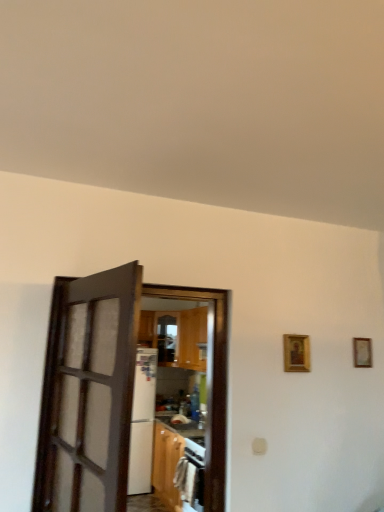
Describe the element at coordinates (296, 353) in the screenshot. I see `gold-framed picture at upper right, which is the second picture frame in right-to-left order` at that location.

The image size is (384, 512). What are the coordinates of `gold-framed picture at right, the 2th picture frame from the left` in the screenshot? It's located at [362, 352].

Describe the element at coordinates (362, 352) in the screenshot. I see `gold-framed picture at right, the 2th picture frame from the left` at that location.

At what (x,y) coordinates should I click in order to perform the action: click on brown wooden door at center, the second door in the front-to-back sequence. Please return your answer as a coordinate pair (x, y). The height and width of the screenshot is (512, 384). Looking at the image, I should click on 211,383.

From the image's perspective, which is above, dark wood door at left, the 1th door from the front, or gold-framed picture at upper right, the first picture frame in the left-to-right sequence?

gold-framed picture at upper right, the first picture frame in the left-to-right sequence, from the image's perspective.

Does dark wood door at left, the 1th door from the front, have a lesser width compared to gold-framed picture at upper right, the first picture frame in the left-to-right sequence?

In fact, dark wood door at left, the 1th door from the front, might be wider than gold-framed picture at upper right, the first picture frame in the left-to-right sequence.

Considering the sizes of objects dark wood door at left, arranged as the 2th door when viewed from the back, and gold-framed picture at upper right, which is the second picture frame in right-to-left order, in the image provided, who is taller, dark wood door at left, arranged as the 2th door when viewed from the back, or gold-framed picture at upper right, which is the second picture frame in right-to-left order,?

Standing taller between the two is dark wood door at left, arranged as the 2th door when viewed from the back.

Could you tell me if dark wood door at left, arranged as the 2th door when viewed from the back, is facing gold-framed picture at upper right, the first picture frame in the left-to-right sequence?

Yes, dark wood door at left, arranged as the 2th door when viewed from the back, is facing gold-framed picture at upper right, the first picture frame in the left-to-right sequence.

Which of these two, dark wood door at left, the 1th door from the front, or brown wooden door at center, the second door in the front-to-back sequence, is wider?

Wider between the two is brown wooden door at center, the second door in the front-to-back sequence.

Would you say dark wood door at left, the 1th door from the front, is a long distance from brown wooden door at center, which is counted as the first door, starting from the back?

No, there isn't a large distance between dark wood door at left, the 1th door from the front, and brown wooden door at center, which is counted as the first door, starting from the back.

Find the location of `door lying above the brown wooden door at center, which is counted as the first door, starting from the back (from the image's perspective)`. door lying above the brown wooden door at center, which is counted as the first door, starting from the back (from the image's perspective) is located at coordinates tap(88, 393).

Is dark wood door at left, arranged as the 2th door when viewed from the back, looking in the opposite direction of brown wooden door at center, which is counted as the first door, starting from the back?

No.

Is gold-framed picture at right, the 2th picture frame in the front-to-back sequence, positioned in front of dark wood door at left, arranged as the 2th door when viewed from the back?

No, gold-framed picture at right, the 2th picture frame in the front-to-back sequence, is further to the viewer.

Between point (370, 365) and point (129, 429), which one is positioned in front?

The point (370, 365) is more forward.

Is gold-framed picture at right, the 2th picture frame in the front-to-back sequence, taller or shorter than dark wood door at left, arranged as the 2th door when viewed from the back?

gold-framed picture at right, the 2th picture frame in the front-to-back sequence, is shorter than dark wood door at left, arranged as the 2th door when viewed from the back.

Does point (191, 290) come farther from viewer compared to point (302, 346)?

No, it is not.

Between brown wooden door at center, the second door in the front-to-back sequence, and gold-framed picture at upper right, the 2th picture frame when ordered from back to front, which one has larger width?

brown wooden door at center, the second door in the front-to-back sequence, is wider.

Consider the image. From the image's perspective, is brown wooden door at center, the second door in the front-to-back sequence, beneath gold-framed picture at upper right, the first picture frame in the left-to-right sequence?

Yes, from the image's perspective, brown wooden door at center, the second door in the front-to-back sequence, is below gold-framed picture at upper right, the first picture frame in the left-to-right sequence.

From a real-world perspective, is brown wooden door at center, which is counted as the first door, starting from the back, physically located above or below gold-framed picture at upper right, which is the second picture frame in right-to-left order?

From a real-world perspective, brown wooden door at center, which is counted as the first door, starting from the back, is physically below gold-framed picture at upper right, which is the second picture frame in right-to-left order.

What's the angular difference between brown wooden door at center, the second door in the front-to-back sequence, and dark wood door at left, the 1th door from the front,'s facing directions?

There is a 103-degree angle between the facing directions of brown wooden door at center, the second door in the front-to-back sequence, and dark wood door at left, the 1th door from the front.

Consider the image. Can you confirm if brown wooden door at center, which is counted as the first door, starting from the back, is shorter than dark wood door at left, the 1th door from the front?

No.

From the image's perspective, which one is positioned lower, brown wooden door at center, which is counted as the first door, starting from the back, or dark wood door at left, arranged as the 2th door when viewed from the back?

brown wooden door at center, which is counted as the first door, starting from the back, appears lower in the image.

This screenshot has width=384, height=512. What are the coordinates of `door that appears below the dark wood door at left, arranged as the 2th door when viewed from the back (from the image's perspective)` in the screenshot? It's located at (211, 383).

From the image's perspective, which one is positioned higher, brown wooden door at center, which is counted as the first door, starting from the back, or gold-framed picture at right, the 1th picture frame viewed from the back?

gold-framed picture at right, the 1th picture frame viewed from the back.

Based on the photo, is brown wooden door at center, the second door in the front-to-back sequence, positioned far away from gold-framed picture at right, the 2th picture frame from the left?

brown wooden door at center, the second door in the front-to-back sequence, is near gold-framed picture at right, the 2th picture frame from the left, not far away.

Does brown wooden door at center, the second door in the front-to-back sequence, have a lesser height compared to gold-framed picture at right, the 1th picture frame viewed from the back?

In fact, brown wooden door at center, the second door in the front-to-back sequence, may be taller than gold-framed picture at right, the 1th picture frame viewed from the back.

Considering the positions of objects brown wooden door at center, the second door in the front-to-back sequence, and gold-framed picture at right, the 2th picture frame from the left, in the image provided, who is more to the left, brown wooden door at center, the second door in the front-to-back sequence, or gold-framed picture at right, the 2th picture frame from the left,?

brown wooden door at center, the second door in the front-to-back sequence.

In the scene shown: From a real-world perspective, relative to gold-framed picture at upper right, which ranks as the first picture frame in front-to-back order, is gold-framed picture at right, which is the first picture frame in right-to-left order, vertically above or below?

gold-framed picture at right, which is the first picture frame in right-to-left order, is situated higher than gold-framed picture at upper right, which ranks as the first picture frame in front-to-back order, in the real world.

From the image's perspective, which one is positioned lower, gold-framed picture at right, the 2th picture frame in the front-to-back sequence, or gold-framed picture at upper right, which is the second picture frame in right-to-left order?

gold-framed picture at right, the 2th picture frame in the front-to-back sequence, appears lower in the image.

At what (x,y) coordinates should I click in order to perform the action: click on picture frame that is above the gold-framed picture at right, which is the first picture frame in right-to-left order (from the image's perspective). Please return your answer as a coordinate pair (x, y). Looking at the image, I should click on (296, 353).

Identify the location of the 1st picture frame to the right of the dark wood door at left, the 1th door from the front, starting your count from the anchor. Image resolution: width=384 pixels, height=512 pixels. (296, 353).

In the image, there is a brown wooden door at center, which is counted as the first door, starting from the back. Identify the location of door above it (from the image's perspective). Image resolution: width=384 pixels, height=512 pixels. (88, 393).

Which object lies nearer to the anchor point brown wooden door at center, the second door in the front-to-back sequence, gold-framed picture at upper right, which ranks as the first picture frame in front-to-back order, or gold-framed picture at right, the 1th picture frame viewed from the back?

gold-framed picture at upper right, which ranks as the first picture frame in front-to-back order, lies closer to brown wooden door at center, the second door in the front-to-back sequence, than the other object.

When comparing their distances from gold-framed picture at upper right, which ranks as the first picture frame in front-to-back order, does brown wooden door at center, which is counted as the first door, starting from the back, or gold-framed picture at right, the 2th picture frame in the front-to-back sequence, seem further?

The object further to gold-framed picture at upper right, which ranks as the first picture frame in front-to-back order, is brown wooden door at center, which is counted as the first door, starting from the back.

Looking at the image, which one is located further to gold-framed picture at right, the 1th picture frame viewed from the back, brown wooden door at center, the second door in the front-to-back sequence, or dark wood door at left, the 1th door from the front?

dark wood door at left, the 1th door from the front, is positioned further to the anchor gold-framed picture at right, the 1th picture frame viewed from the back.

Which object lies further to the anchor point brown wooden door at center, which is counted as the first door, starting from the back, dark wood door at left, arranged as the 2th door when viewed from the back, or gold-framed picture at right, which is the first picture frame in right-to-left order?

Based on the image, gold-framed picture at right, which is the first picture frame in right-to-left order, appears to be further to brown wooden door at center, which is counted as the first door, starting from the back.

Based on their spatial positions, is dark wood door at left, the 1th door from the front, or gold-framed picture at upper right, the 2th picture frame when ordered from back to front, further from gold-framed picture at right, which is the first picture frame in right-to-left order?

dark wood door at left, the 1th door from the front, lies further to gold-framed picture at right, which is the first picture frame in right-to-left order, than the other object.

Which object lies further to the anchor point brown wooden door at center, the second door in the front-to-back sequence, gold-framed picture at right, which is the first picture frame in right-to-left order, or gold-framed picture at upper right, the first picture frame in the left-to-right sequence?

gold-framed picture at right, which is the first picture frame in right-to-left order, lies further to brown wooden door at center, the second door in the front-to-back sequence, than the other object.

When comparing their distances from gold-framed picture at right, the 2th picture frame from the left, does dark wood door at left, the 1th door from the front, or brown wooden door at center, the second door in the front-to-back sequence, seem closer?

Among the two, brown wooden door at center, the second door in the front-to-back sequence, is located nearer to gold-framed picture at right, the 2th picture frame from the left.

Considering their positions, is gold-framed picture at right, the 2th picture frame in the front-to-back sequence, positioned further to gold-framed picture at upper right, the 2th picture frame when ordered from back to front, than brown wooden door at center, the second door in the front-to-back sequence?

Among the two, brown wooden door at center, the second door in the front-to-back sequence, is located further to gold-framed picture at upper right, the 2th picture frame when ordered from back to front.

Find the location of a particular element. picture frame between dark wood door at left, arranged as the 2th door when viewed from the back, and gold-framed picture at right, the 2th picture frame from the left, from front to back is located at coordinates (296, 353).

What are the coordinates of `picture frame between brown wooden door at center, the second door in the front-to-back sequence, and gold-framed picture at right, the 2th picture frame in the front-to-back sequence, in the horizontal direction` in the screenshot? It's located at (296, 353).

Find the location of a particular element. door between dark wood door at left, the 1th door from the front, and gold-framed picture at upper right, which is the second picture frame in right-to-left order, from front to back is located at coordinates point(211,383).

Where is `door situated between dark wood door at left, arranged as the 2th door when viewed from the back, and gold-framed picture at right, the 2th picture frame in the front-to-back sequence, from left to right`? The image size is (384, 512). door situated between dark wood door at left, arranged as the 2th door when viewed from the back, and gold-framed picture at right, the 2th picture frame in the front-to-back sequence, from left to right is located at coordinates (211, 383).